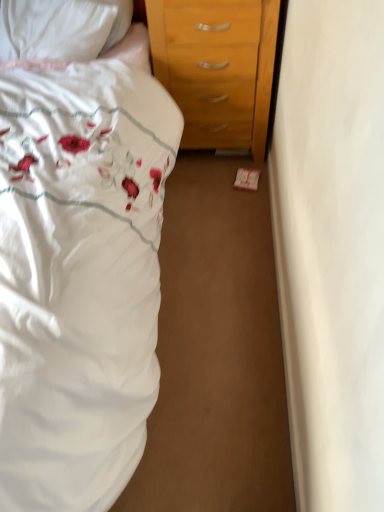
The width and height of the screenshot is (384, 512). What do you see at coordinates (62, 28) in the screenshot?
I see `white satin pillow at upper left` at bounding box center [62, 28].

Where is `white satin pillow at upper left`? The image size is (384, 512). white satin pillow at upper left is located at coordinates click(x=62, y=28).

Locate an element on the screen. white floral fabric bed at left is located at coordinates (79, 277).

Describe the element at coordinates (79, 277) in the screenshot. The width and height of the screenshot is (384, 512). I see `white floral fabric bed at left` at that location.

What are the coordinates of `white satin pillow at upper left` in the screenshot? It's located at (62, 28).

Visually, is white satin pillow at upper left positioned to the left or to the right of white floral fabric bed at left?

In the image, white satin pillow at upper left appears on the right side of white floral fabric bed at left.

Is white satin pillow at upper left further to the viewer compared to white floral fabric bed at left?

Yes, it is behind white floral fabric bed at left.

Is point (66, 0) positioned in front of point (16, 126)?

No, (66, 0) is behind (16, 126).

From the picture: From the image's perspective, is white satin pillow at upper left beneath white floral fabric bed at left?

No, from the image's perspective, white satin pillow at upper left is not below white floral fabric bed at left.

From a real-world perspective, which is physically above, white satin pillow at upper left or white floral fabric bed at left?

white satin pillow at upper left is physically above.

Can you confirm if white satin pillow at upper left is thinner than white floral fabric bed at left?

Indeed, white satin pillow at upper left has a lesser width compared to white floral fabric bed at left.

Which of these two, white satin pillow at upper left or white floral fabric bed at left, stands shorter?

Standing shorter between the two is white satin pillow at upper left.

Looking at this image, considering the sizes of objects white satin pillow at upper left and white floral fabric bed at left in the image provided, who is bigger, white satin pillow at upper left or white floral fabric bed at left?

white floral fabric bed at left is bigger.

Is white floral fabric bed at left surrounded by white satin pillow at upper left?

No, white satin pillow at upper left does not contain white floral fabric bed at left.

Is white satin pillow at upper left not near white floral fabric bed at left?

No, white satin pillow at upper left is in close proximity to white floral fabric bed at left.

Is white satin pillow at upper left looking in the opposite direction of white floral fabric bed at left?

Yes.

Based on the photo, what's the angular difference between white satin pillow at upper left and white floral fabric bed at left's facing directions?

The facing directions of white satin pillow at upper left and white floral fabric bed at left are 21.5 degrees apart.

Locate an element on the screen. This screenshot has height=512, width=384. pillow above the white floral fabric bed at left (from a real-world perspective) is located at coordinates (62, 28).

Looking at this image, between white floral fabric bed at left and white satin pillow at upper left, which one appears on the left side from the viewer's perspective?

white floral fabric bed at left.

Is the depth of white floral fabric bed at left less than that of white satin pillow at upper left?

Yes, white floral fabric bed at left is in front of white satin pillow at upper left.

Considering the points (25, 319) and (40, 3), which point is in front, point (25, 319) or point (40, 3)?

The point (25, 319) is closer.

From the image's perspective, is white floral fabric bed at left below white satin pillow at upper left?

Yes, from the image's perspective, white floral fabric bed at left is below white satin pillow at upper left.

From a real-world perspective, between white floral fabric bed at left and white satin pillow at upper left, who is vertically lower?

white floral fabric bed at left, from a real-world perspective.

Is white floral fabric bed at left wider than white satin pillow at upper left?

Yes.

Considering the sizes of objects white floral fabric bed at left and white satin pillow at upper left in the image provided, who is shorter, white floral fabric bed at left or white satin pillow at upper left?

white satin pillow at upper left.

Who is smaller, white floral fabric bed at left or white satin pillow at upper left?

white satin pillow at upper left is smaller.

Could white satin pillow at upper left be considered to be inside white floral fabric bed at left?

Yes, white satin pillow at upper left is a part of white floral fabric bed at left.

Is white floral fabric bed at left placed right next to white satin pillow at upper left?

white floral fabric bed at left and white satin pillow at upper left are clearly separated.

Is white floral fabric bed at left facing away from white satin pillow at upper left?

Yes, white floral fabric bed at left is positioned with its back facing white satin pillow at upper left.

What's the angular difference between white floral fabric bed at left and white satin pillow at upper left's facing directions?

The angular difference between white floral fabric bed at left and white satin pillow at upper left is 21.5 degrees.

At what (x,y) coordinates should I click in order to perform the action: click on pillow located behind the white floral fabric bed at left. Please return your answer as a coordinate pair (x, y). Image resolution: width=384 pixels, height=512 pixels. Looking at the image, I should click on (62, 28).

Where is `bed to the left of white satin pillow at upper left`? The width and height of the screenshot is (384, 512). bed to the left of white satin pillow at upper left is located at coordinates (79, 277).

At what (x,y) coordinates should I click in order to perform the action: click on bed lying below the white satin pillow at upper left (from the image's perspective). Please return your answer as a coordinate pair (x, y). The height and width of the screenshot is (512, 384). Looking at the image, I should click on (79, 277).